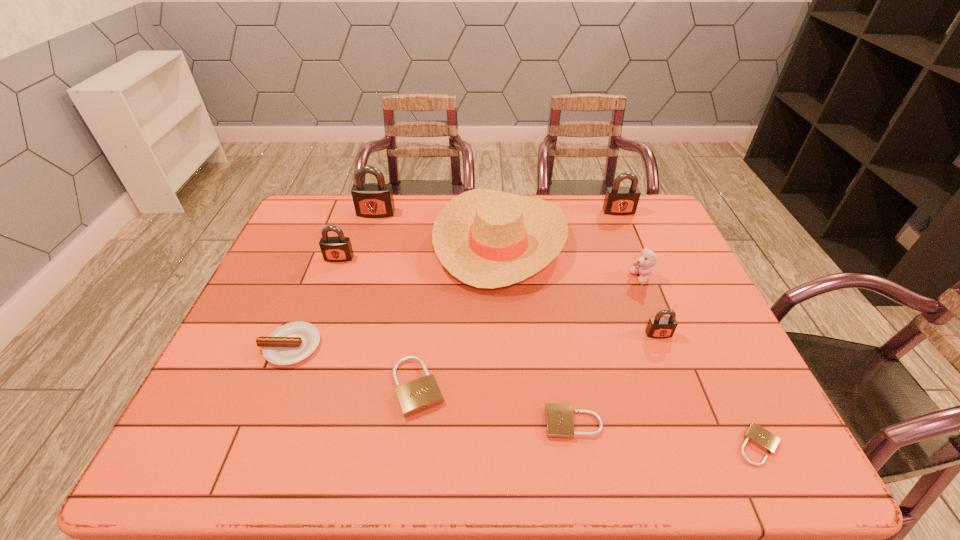
Image resolution: width=960 pixels, height=540 pixels. In order to click on free space located 0.200m on the front of the second nearest gray padlock near the keyhole in this screenshot , I will do click(320, 312).

Where is `vacant space situated 0.100m at the face of the teddy bear`? The width and height of the screenshot is (960, 540). vacant space situated 0.100m at the face of the teddy bear is located at coordinates (595, 278).

Image resolution: width=960 pixels, height=540 pixels. Identify the location of vacant space located at the face of the teddy bear. (492, 278).

Identify the location of blank area located at the face of the teddy bear. The width and height of the screenshot is (960, 540). pos(588,278).

I want to click on vacant area situated 0.170m on the front of the fourth farthest padlock near the keyhole, so click(x=684, y=399).

I want to click on free space located 0.290m on the right of the sausage, so click(x=437, y=346).

Where is `free space located on the right of the fifth padlock from right to left`? free space located on the right of the fifth padlock from right to left is located at coordinates (598, 387).

You are a GUI agent. You are given a task and a screenshot of the screen. Output one action in this format:
    pyautogui.click(x=<x>, y=<y>)
    Task: Click on the free space located on the back of the second smallest beige padlock
    This screenshot has width=960, height=540.
    Given the screenshot: What is the action you would take?
    pyautogui.click(x=557, y=321)

In order to click on free space located on the left of the rightmost beige padlock in this screenshot , I will do `click(687, 445)`.

Find the location of `sunhat situated at the far edge`. sunhat situated at the far edge is located at coordinates (486, 238).